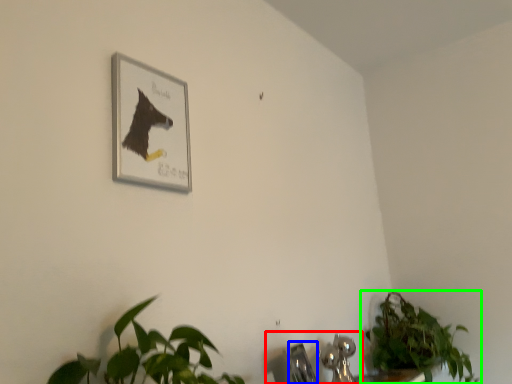
Question: Which is farther away from sink (highlighted by a red box)? faucet (highlighted by a blue box) or houseplant (highlighted by a green box)?

Choices:
 (A) faucet
 (B) houseplant

Answer: (B)